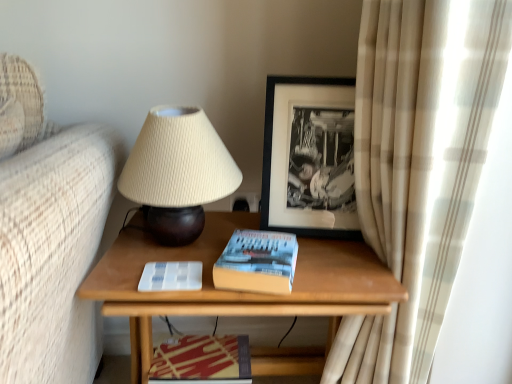
This screenshot has width=512, height=384. Identify the location of free space between black matte picture frame at upper center and hardcover book at center. (320, 255).